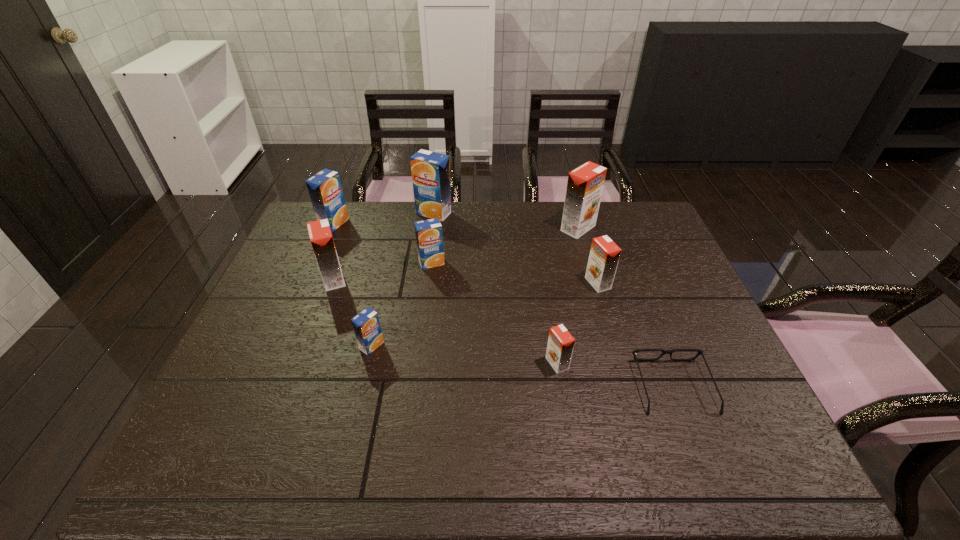
At what (x,y) coordinates should I click in order to perform the action: click on vacant area between the third biggest blue orange_juice and the second smallest orange orange juice. Please return your answer as a coordinate pair (x, y). The height and width of the screenshot is (540, 960). Looking at the image, I should click on (515, 273).

Identify the location of free spot between the biggest blue orange_juice and the sixth orange juice from left to right. (495, 288).

At what (x,y) coordinates should I click in order to perform the action: click on vacant region between the second smallest orange orange juice and the smallest blue orange_juice. Please return your answer as a coordinate pair (x, y). Looking at the image, I should click on (485, 314).

Locate an element on the screen. This screenshot has width=960, height=540. vacant area that lies between the farthest orange orange juice and the third orange juice from left to right is located at coordinates (475, 287).

Where is `unoccupied position between the nearest orange orange juice and the second smallest blue orange_juice`? unoccupied position between the nearest orange orange juice and the second smallest blue orange_juice is located at coordinates (494, 313).

Where is `blank region between the farthest orange orange juice and the third object from left to right`? The image size is (960, 540). blank region between the farthest orange orange juice and the third object from left to right is located at coordinates (475, 287).

Locate an element on the screen. The image size is (960, 540). empty space that is in between the leftmost orange orange juice and the third biggest blue orange_juice is located at coordinates (383, 271).

The height and width of the screenshot is (540, 960). I want to click on vacant space that is in between the third biggest orange orange juice and the spectacles, so click(636, 335).

The height and width of the screenshot is (540, 960). Identify the location of vacant space that is in between the second biggest orange orange juice and the smallest orange orange juice. (445, 321).

Identify which object is located as the seventh nearest to the leftmost blue orange_juice. Please provide its 2D coordinates. Your answer should be formatted as a tuple, i.e. [(x, y)], where the tuple contains the x and y coordinates of a point satisfying the conditions above.

[(560, 345)]